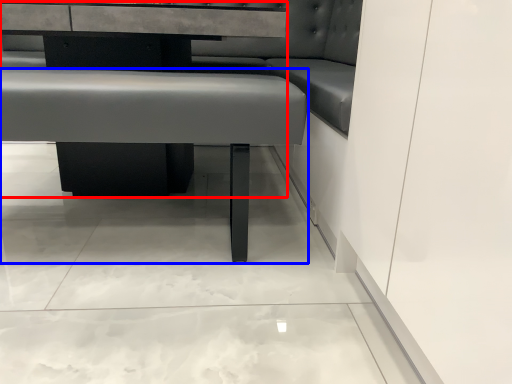
Question: Which of the following is the closest to the observer, table (highlighted by a red box) or vanity (highlighted by a blue box)?

Choices:
 (A) table
 (B) vanity

Answer: (B)